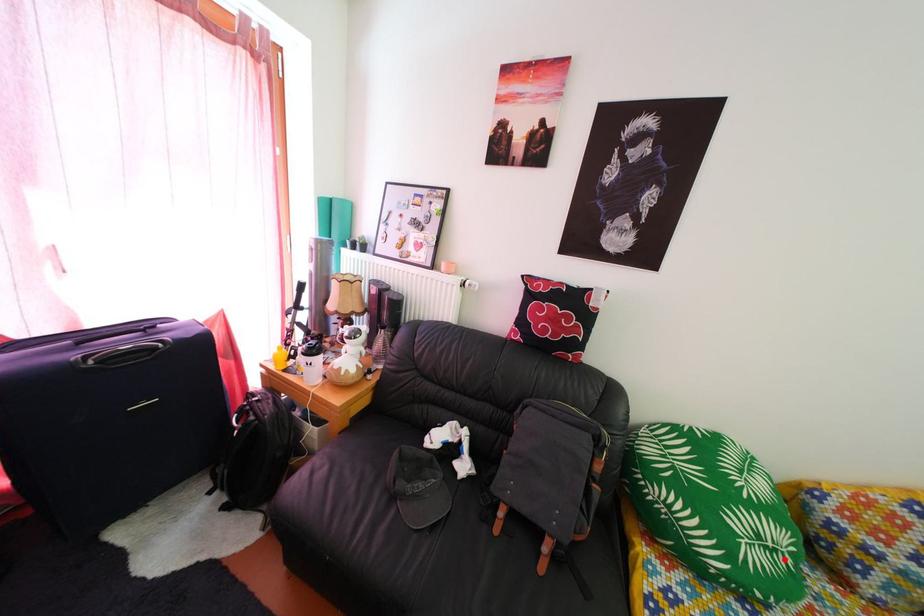
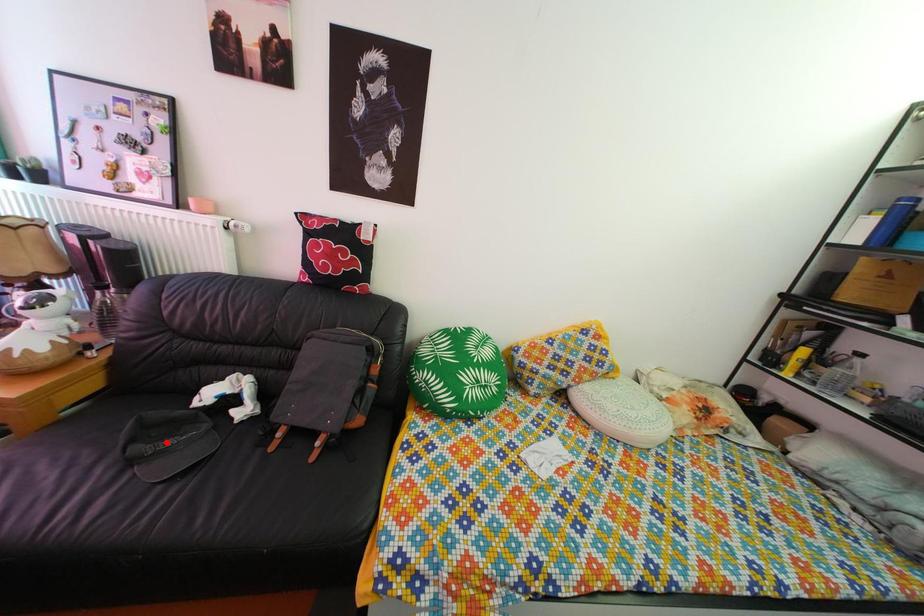
I am providing you with two images of the same scene from different viewpoints. A red point is marked on the first image and another point is marked on the second image. Is the red point in image1 aligned with the point shown in image2?

No